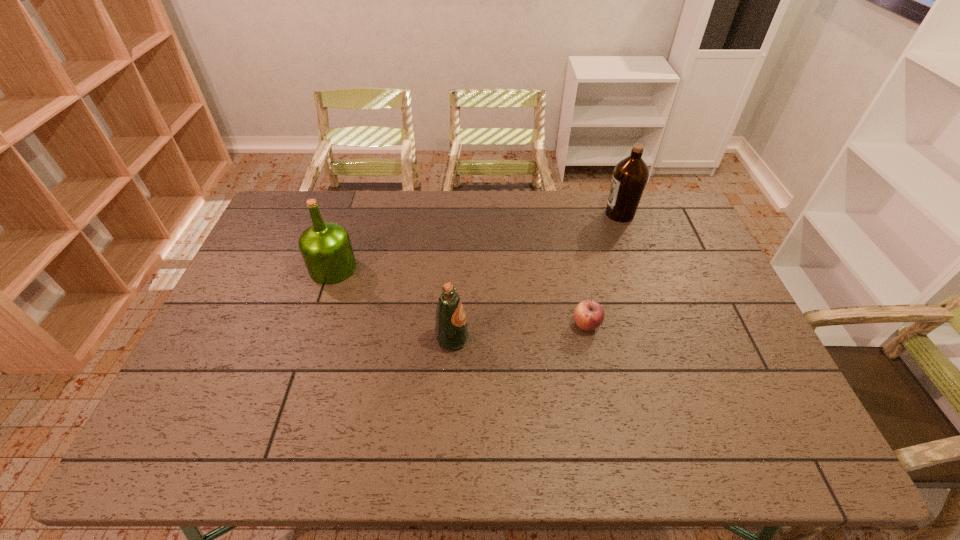
Choose which object is the second nearest neighbor to the second olive oil from left to right. Please provide its 2D coordinates. Your answer should be formatted as a tuple, i.e. [(x, y)], where the tuple contains the x and y coordinates of a point satisfying the conditions above.

[(326, 248)]

Find the location of a particular element. The height and width of the screenshot is (540, 960). the closest olive oil relative to the leftmost object is located at coordinates (451, 330).

Identify which olive oil is the second closest to the third object from right to left. Please provide its 2D coordinates. Your answer should be formatted as a tuple, i.e. [(x, y)], where the tuple contains the x and y coordinates of a point satisfying the conditions above.

[(630, 176)]

Identify the location of vacant area in the image that satisfies the following two spatial constraints: 1. on the front side of the shortest object; 2. on the front-facing side of the shortest olive oil. The image size is (960, 540). (589, 339).

What are the coordinates of `blank area in the image that satisfies the following two spatial constraints: 1. on the label of the farthest olive oil; 2. on the front side of the second object from right to left` in the screenshot? It's located at (660, 325).

Locate an element on the screen. vacant region that satisfies the following two spatial constraints: 1. on the label of the rightmost olive oil; 2. on the front side of the leftmost olive oil is located at coordinates (639, 268).